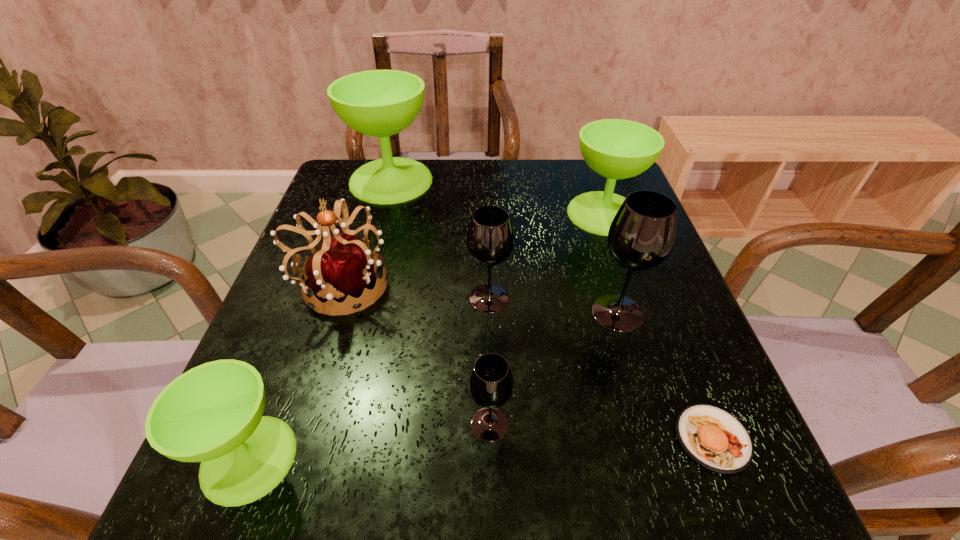
In order to click on the biggest green wineglass in this screenshot , I will do `click(380, 103)`.

Where is `the rightmost gray wineglass`? the rightmost gray wineglass is located at coordinates (641, 236).

Where is `tiara`? The image size is (960, 540). tiara is located at coordinates (342, 267).

This screenshot has height=540, width=960. I want to click on the rightmost green wineglass, so click(x=617, y=149).

Image resolution: width=960 pixels, height=540 pixels. Identify the location of the second biggest gray wineglass. (490, 238).

Identify the location of the nearest gray wineglass. This screenshot has width=960, height=540. (490, 383).

The width and height of the screenshot is (960, 540). What are the coordinates of `the nearest green wineglass` in the screenshot? It's located at (213, 413).

I want to click on patty, so click(714, 438).

This screenshot has height=540, width=960. Identify the location of vacant space located on the right of the biggest green wineglass. (539, 181).

I want to click on free space located on the right of the rightmost gray wineglass, so click(690, 312).